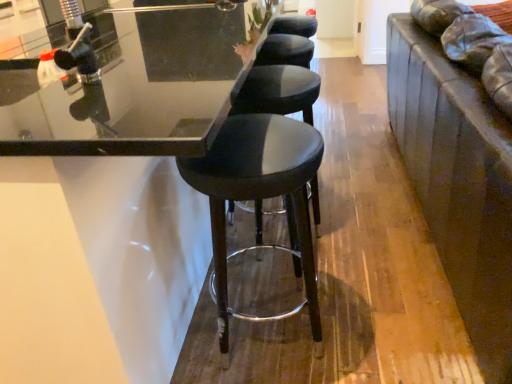
Question: Can you confirm if black leather stool at center, which is the first stool from back to front, is shorter than black leather stool at center, which is the first stool from front to back?

Choices:
 (A) no
 (B) yes

Answer: (A)

Question: Is black leather stool at center, which is the first stool from front to back, inside black leather stool at center, which is counted as the second stool, starting from the front?

Choices:
 (A) yes
 (B) no

Answer: (B)

Question: Is black leather stool at center, which is the first stool from back to front, next to black leather stool at center, placed as the 2th stool when sorted from back to front?

Choices:
 (A) no
 (B) yes

Answer: (A)

Question: Is black leather stool at center, which is counted as the second stool, starting from the front, further to the viewer compared to black leather stool at center, which is the first stool from front to back?

Choices:
 (A) yes
 (B) no

Answer: (A)

Question: Is black leather stool at center, which is counted as the second stool, starting from the front, turned away from black leather stool at center, which is the first stool from front to back?

Choices:
 (A) yes
 (B) no

Answer: (B)

Question: Would you say black leather stool at center, which is the first stool from back to front, is outside black leather stool at center, which is the first stool from front to back?

Choices:
 (A) yes
 (B) no

Answer: (A)

Question: Is black leather stool at center, which is the first stool from front to back, smaller than black leather stool at center, which is the first stool from back to front?

Choices:
 (A) yes
 (B) no

Answer: (A)

Question: From a real-world perspective, is black leather stool at center, which is the first stool from front to back, located higher than black leather stool at center, which is counted as the second stool, starting from the front?

Choices:
 (A) no
 (B) yes

Answer: (B)

Question: Can you confirm if black leather stool at center, which is the first stool from front to back, is taller than black leather stool at center, which is the first stool from back to front?

Choices:
 (A) yes
 (B) no

Answer: (B)

Question: Is black leather stool at center, which is the first stool from front to back, not inside black leather stool at center, which is counted as the second stool, starting from the front?

Choices:
 (A) no
 (B) yes

Answer: (B)

Question: Is black leather stool at center, which is the first stool from front to back, wider than black leather stool at center, which is counted as the second stool, starting from the front?

Choices:
 (A) yes
 (B) no

Answer: (A)

Question: Does black leather stool at center, which is the first stool from front to back, touch black leather stool at center, which is the first stool from back to front?

Choices:
 (A) no
 (B) yes

Answer: (A)

Question: Considering the positions of black leather stool at center, which is the first stool from front to back, and black leather stool at center, which is the first stool from back to front, in the image, is black leather stool at center, which is the first stool from front to back, bigger or smaller than black leather stool at center, which is the first stool from back to front,?

Choices:
 (A) small
 (B) big

Answer: (A)